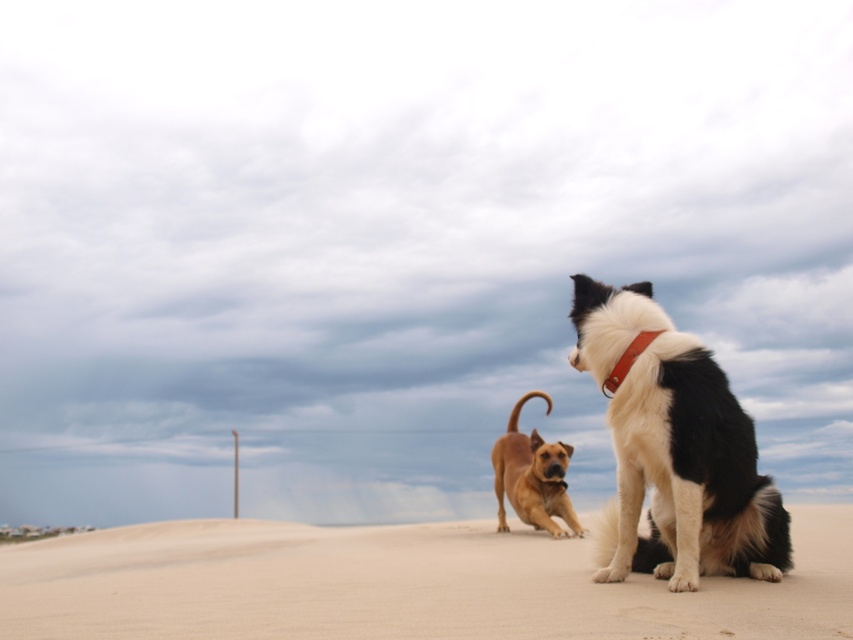
Based on the photo, you are a photographer standing at the edge of the beach. You want to take a photo that includes both the sandy beige sand at lower center and the golden brown fur at center. Given that your camera has a maximum focus range of 6 feet, will you be able to capture both subjects in focus at the same time?

The sandy beige sand at lower center and golden brown fur at center are 6.90 feet apart from each other. Since the distance between them exceeds the camera maximum focus range of 6 feet, you cannot capture both subjects in focus simultaneously.

You are a photographer trying to capture a photo of the two dogs on the sandy beige sand at lower center. You notice the brown leather neckband at upper right might be distracting. To avoid including the neckband in your shot, should you move left or right?

The sandy beige sand at lower center is to the left of the brown leather neckband at upper right. To avoid including the neckband, move to the right so that the neckband is out of frame to the left.

You are a photographer trying to capture a photo of the golden brown fur at center and the sandy beige sand at lower center. Based on their positions, which object is closer to the camera?

The golden brown fur at center is closer to the camera because the sandy beige sand at lower center is located below it, indicating it is positioned further back.